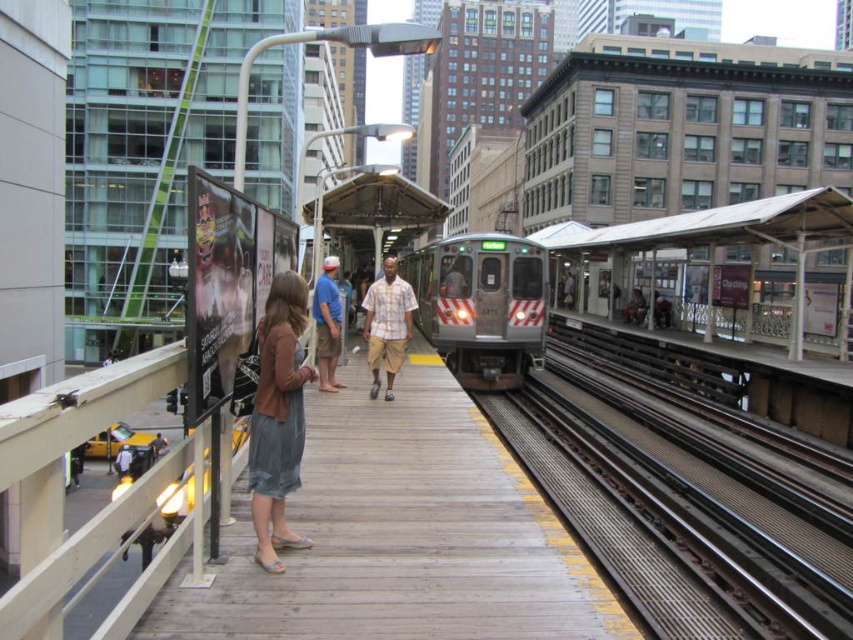
You are standing on the platform at the train station. You see the silver metallic train at center and the blue cotton shirt at center. How far apart are these two objects?

The silver metallic train at center is 9.99 meters away from the blue cotton shirt at center.

You are standing at point [317,285] in the train station. You want to walk to point [297,308]. Which direction should you move relative to the train?

You should move in the direction towards the train because point [297,308] is in front of point [317,285].